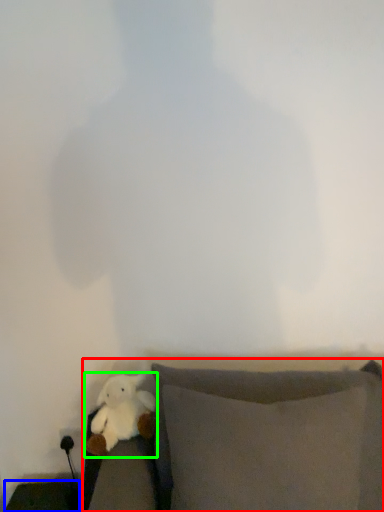
Question: Estimate the real-world distances between objects in this image. Which object is closer to furniture (highlighted by a red box), furniture (highlighted by a blue box) or toy (highlighted by a green box)?

Choices:
 (A) furniture
 (B) toy

Answer: (B)